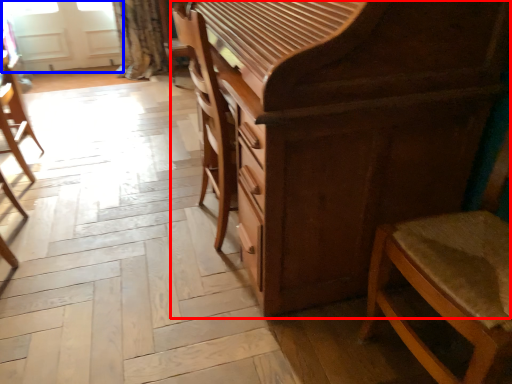
Question: Which point is closer to the camera, chest of drawers (highlighted by a red box) or screen door (highlighted by a blue box)?

Choices:
 (A) chest of drawers
 (B) screen door

Answer: (A)